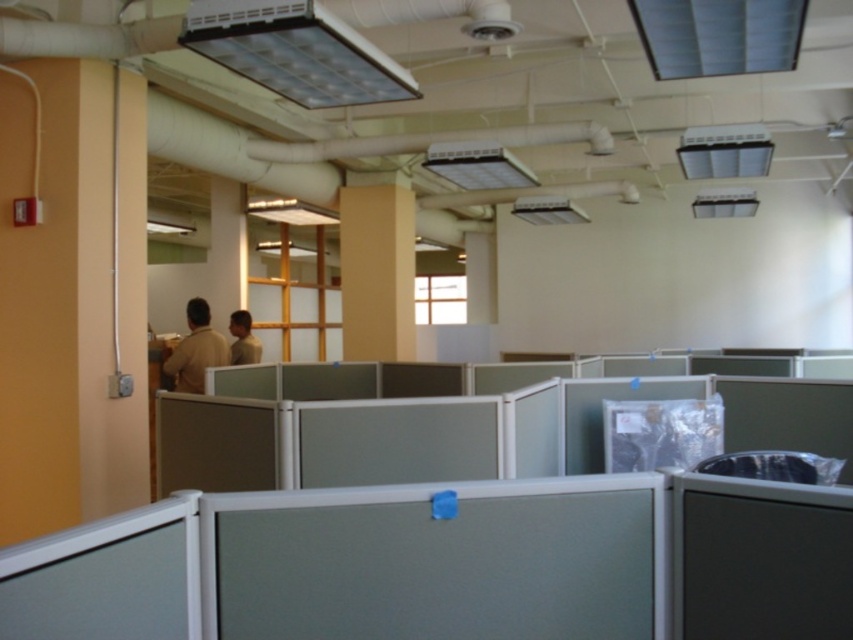
You are an office worker who needs to locate the person in the brown matte shirt at left. From the perspective of the light brown shirt at center, which direction should you look to find them?

The brown matte shirt at left is in front of the light brown shirt at center, so from the perspective of the light brown shirt at center, you should look forward to find the brown matte shirt at left.